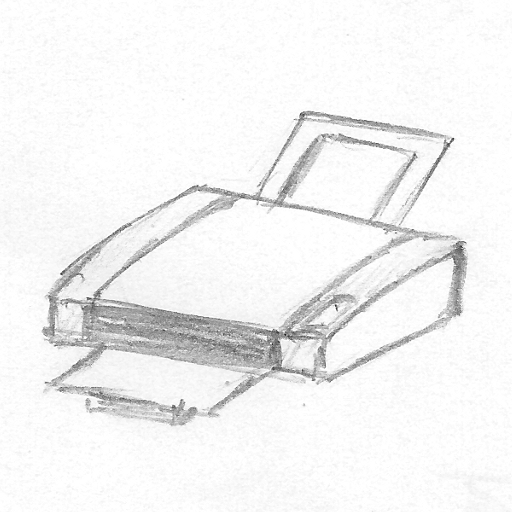
Where is `paper holder`? The image size is (512, 512). paper holder is located at coordinates (178, 413), (442, 146).